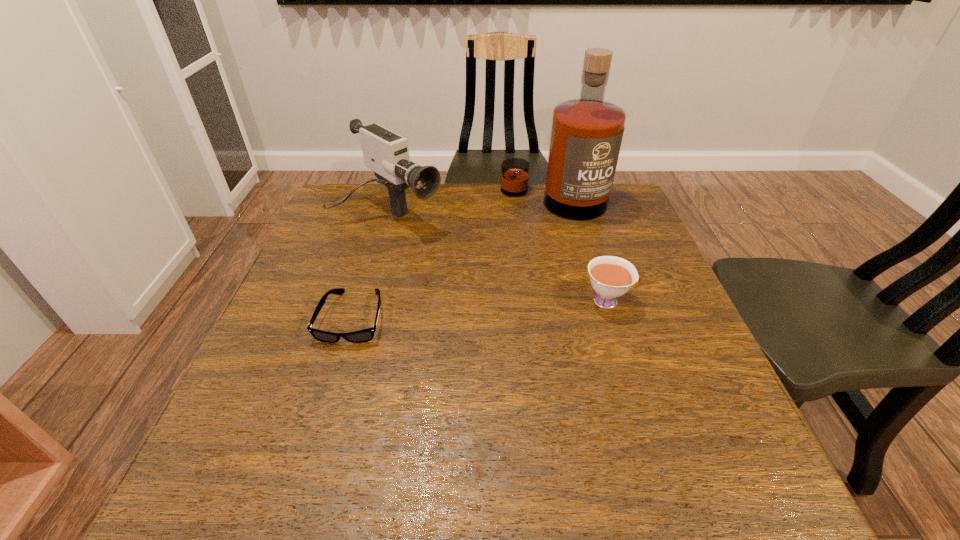
The width and height of the screenshot is (960, 540). In order to click on vacant space at the far edge of the desktop in this screenshot , I will do `click(413, 199)`.

Image resolution: width=960 pixels, height=540 pixels. I want to click on free spot at the near edge of the desktop, so click(321, 417).

The image size is (960, 540). In the image, there is a desktop. Find the location of `vacant space at the left edge`. vacant space at the left edge is located at coordinates (359, 246).

Locate an element on the screen. Image resolution: width=960 pixels, height=540 pixels. free region at the right edge of the desktop is located at coordinates point(631,230).

Where is `vacant area at the far left corner`? This screenshot has height=540, width=960. vacant area at the far left corner is located at coordinates (345, 202).

Find the location of a particular element. This screenshot has width=960, height=540. vacant space at the far right corner is located at coordinates (616, 210).

The height and width of the screenshot is (540, 960). Identify the location of free space between the shortest object and the tallest object. (453, 259).

Locate an element on the screen. This screenshot has width=960, height=540. unoccupied position between the second tallest object and the sunglasses is located at coordinates (371, 266).

The width and height of the screenshot is (960, 540). Identify the location of free spot between the third shortest object and the sunglasses. (371, 266).

The width and height of the screenshot is (960, 540). What are the coordinates of `blank region between the shortest object and the second tallest object` in the screenshot? It's located at (371, 266).